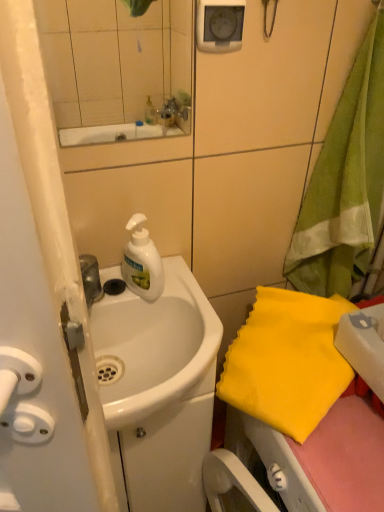
The width and height of the screenshot is (384, 512). In order to click on yellow fabric at lower right, the 2th beach towel in the top-to-bottom sequence in this screenshot , I will do click(x=287, y=361).

This screenshot has height=512, width=384. I want to click on yellow fabric at right, arranged as the 2th beach towel when ordered from the bottom, so click(x=345, y=183).

How much space does yellow fabric at right, which is counted as the first beach towel, starting from the top, occupy vertically?

yellow fabric at right, which is counted as the first beach towel, starting from the top, is 26.60 inches tall.

Where is `white glossy sink at center`? The image size is (384, 512). white glossy sink at center is located at coordinates (155, 346).

In order to face white glossy sink at center, should I rotate leftwards or rightwards?

A 4.721 degree turn to the left will do.

This screenshot has height=512, width=384. Identify the location of white matte liquid soap at center. (143, 266).

Find the location of a particular element. This screenshot has width=384, height=512. yellow fabric at lower right, the 2th beach towel in the top-to-bottom sequence is located at coordinates (287, 361).

Locate an element on the screen. Image resolution: width=384 pixels, height=512 pixels. sink lying above the yellow fabric at lower right, the 1th beach towel positioned from the bottom (from the image's perspective) is located at coordinates (155, 346).

Can you confirm if white glossy sink at center is bigger than yellow fabric at lower right, the 2th beach towel in the top-to-bottom sequence?

No.

Which object is closer to the camera taking this photo, white glossy sink at center or yellow fabric at lower right, the 1th beach towel positioned from the bottom?

Positioned in front is white glossy sink at center.

Which object is thinner, white glossy sink at center or yellow fabric at lower right, the 1th beach towel positioned from the bottom?

With smaller width is yellow fabric at lower right, the 1th beach towel positioned from the bottom.

The height and width of the screenshot is (512, 384). I want to click on beach towel below the white matte liquid soap at center (from the image's perspective), so click(287, 361).

Who is more distant, white matte liquid soap at center or yellow fabric at lower right, the 1th beach towel positioned from the bottom?

white matte liquid soap at center is further from the camera.

From the image's perspective, which one is positioned higher, white matte liquid soap at center or yellow fabric at lower right, the 2th beach towel in the top-to-bottom sequence?

white matte liquid soap at center appears higher in the image.

Is matte glass mirror at upper center to the left of white glossy sink at center from the viewer's perspective?

Correct, you'll find matte glass mirror at upper center to the left of white glossy sink at center.

From a real-world perspective, is matte glass mirror at upper center located higher than white glossy sink at center?

Indeed, from a real-world perspective, matte glass mirror at upper center stands above white glossy sink at center.

Are matte glass mirror at upper center and white glossy sink at center making contact?

No, matte glass mirror at upper center is not next to white glossy sink at center.

In the image, is matte glass mirror at upper center positioned in front of or behind white glossy sink at center?

In the image, matte glass mirror at upper center appears in front of white glossy sink at center.

Between white glossy sink at center and yellow fabric at right, arranged as the 2th beach towel when ordered from the bottom, which one appears on the left side from the viewer's perspective?

From the viewer's perspective, white glossy sink at center appears more on the left side.

Is the surface of white glossy sink at center in direct contact with yellow fabric at right, arranged as the 2th beach towel when ordered from the bottom?

No, white glossy sink at center is not next to yellow fabric at right, arranged as the 2th beach towel when ordered from the bottom.

Who is more distant, white glossy sink at center or yellow fabric at right, arranged as the 2th beach towel when ordered from the bottom?

white glossy sink at center is more distant.

From the image's perspective, which is above, matte glass mirror at upper center or yellow fabric at right, arranged as the 2th beach towel when ordered from the bottom?

matte glass mirror at upper center, from the image's perspective.

Considering the positions of objects matte glass mirror at upper center and yellow fabric at right, which is counted as the first beach towel, starting from the top, in the image provided, who is in front, matte glass mirror at upper center or yellow fabric at right, which is counted as the first beach towel, starting from the top,?

matte glass mirror at upper center is closer to the camera.

From a real-world perspective, is matte glass mirror at upper center positioned over yellow fabric at right, which is counted as the first beach towel, starting from the top, based on gravity?

Yes, from a real-world perspective, matte glass mirror at upper center is over yellow fabric at right, which is counted as the first beach towel, starting from the top

Identify the location of mirror above the yellow fabric at right, which is counted as the first beach towel, starting from the top (from the image's perspective). Image resolution: width=384 pixels, height=512 pixels. (112, 62).

Which is in front, point (294, 400) or point (101, 12)?

The point (101, 12) is closer to the camera.

How far apart are yellow fabric at lower right, the 2th beach towel in the top-to-bottom sequence, and matte glass mirror at upper center?

yellow fabric at lower right, the 2th beach towel in the top-to-bottom sequence, is 19.33 inches away from matte glass mirror at upper center.

You are a GUI agent. You are given a task and a screenshot of the screen. Output one action in this format:
    pyautogui.click(x=<x>, y=<y>)
    Task: Click on the beach towel that is the 2nd object located behind the matte glass mirror at upper center
    This screenshot has width=384, height=512.
    Given the screenshot: What is the action you would take?
    pyautogui.click(x=287, y=361)

Is yellow fabric at lower right, the 1th beach towel positioned from the bottom, wider than matte glass mirror at upper center?

Correct, the width of yellow fabric at lower right, the 1th beach towel positioned from the bottom, exceeds that of matte glass mirror at upper center.

From a real-world perspective, is white matte liquid soap at center physically located above or below yellow fabric at right, arranged as the 2th beach towel when ordered from the bottom?

From a real-world perspective, white matte liquid soap at center is physically below yellow fabric at right, arranged as the 2th beach towel when ordered from the bottom.

Considering the relative sizes of white matte liquid soap at center and yellow fabric at right, arranged as the 2th beach towel when ordered from the bottom, in the image provided, is white matte liquid soap at center shorter than yellow fabric at right, arranged as the 2th beach towel when ordered from the bottom,?

Yes, white matte liquid soap at center is shorter than yellow fabric at right, arranged as the 2th beach towel when ordered from the bottom.

Is white matte liquid soap at center with yellow fabric at right, arranged as the 2th beach towel when ordered from the bottom?

No, white matte liquid soap at center is not touching yellow fabric at right, arranged as the 2th beach towel when ordered from the bottom.

Is white matte liquid soap at center to the left of yellow fabric at right, which is counted as the first beach towel, starting from the top, from the viewer's perspective?

Indeed, white matte liquid soap at center is positioned on the left side of yellow fabric at right, which is counted as the first beach towel, starting from the top.

Identify the location of sink above the yellow fabric at lower right, the 1th beach towel positioned from the bottom (from a real-world perspective). The image size is (384, 512). (155, 346).

Where is `cleaning product on the left of the yellow fabric at lower right, the 2th beach towel in the top-to-bottom sequence`? The image size is (384, 512). cleaning product on the left of the yellow fabric at lower right, the 2th beach towel in the top-to-bottom sequence is located at coordinates (143, 266).

Consider the image. When comparing their distances from white matte liquid soap at center, does white glossy sink at center or yellow fabric at right, which is counted as the first beach towel, starting from the top, seem closer?

The object closer to white matte liquid soap at center is white glossy sink at center.

Estimate the real-world distances between objects in this image. Which object is closer to matte glass mirror at upper center, yellow fabric at lower right, the 2th beach towel in the top-to-bottom sequence, or white glossy sink at center?

white glossy sink at center.

Estimate the real-world distances between objects in this image. Which object is further from white matte liquid soap at center, yellow fabric at right, which is counted as the first beach towel, starting from the top, or yellow fabric at lower right, the 1th beach towel positioned from the bottom?

Among the two, yellow fabric at right, which is counted as the first beach towel, starting from the top, is located further to white matte liquid soap at center.

Looking at the image, which one is located further to white glossy sink at center, white matte liquid soap at center or yellow fabric at right, arranged as the 2th beach towel when ordered from the bottom?

yellow fabric at right, arranged as the 2th beach towel when ordered from the bottom, is positioned further to the anchor white glossy sink at center.

Looking at the image, which one is located closer to white matte liquid soap at center, yellow fabric at right, arranged as the 2th beach towel when ordered from the bottom, or white glossy sink at center?

Among the two, white glossy sink at center is located nearer to white matte liquid soap at center.

Which object lies further to the anchor point yellow fabric at right, which is counted as the first beach towel, starting from the top, white glossy sink at center or white matte liquid soap at center?

The object further to yellow fabric at right, which is counted as the first beach towel, starting from the top, is white matte liquid soap at center.

Which object lies further to the anchor point white matte liquid soap at center, matte glass mirror at upper center or white glossy sink at center?

The object further to white matte liquid soap at center is matte glass mirror at upper center.

Considering their positions, is yellow fabric at right, arranged as the 2th beach towel when ordered from the bottom, positioned further to yellow fabric at lower right, the 1th beach towel positioned from the bottom, than white glossy sink at center?

yellow fabric at right, arranged as the 2th beach towel when ordered from the bottom.

Locate an element on the screen. This screenshot has height=512, width=384. beach towel situated between matte glass mirror at upper center and yellow fabric at right, arranged as the 2th beach towel when ordered from the bottom, from left to right is located at coordinates (287, 361).

The image size is (384, 512). Find the location of `sink between white matte liquid soap at center and yellow fabric at lower right, the 2th beach towel in the top-to-bottom sequence, from left to right`. sink between white matte liquid soap at center and yellow fabric at lower right, the 2th beach towel in the top-to-bottom sequence, from left to right is located at coordinates (155, 346).

Where is `sink between matte glass mirror at upper center and yellow fabric at right, arranged as the 2th beach towel when ordered from the bottom`? The height and width of the screenshot is (512, 384). sink between matte glass mirror at upper center and yellow fabric at right, arranged as the 2th beach towel when ordered from the bottom is located at coordinates (155, 346).

Locate an element on the screen. cleaning product between matte glass mirror at upper center and yellow fabric at lower right, the 2th beach towel in the top-to-bottom sequence, vertically is located at coordinates (143, 266).